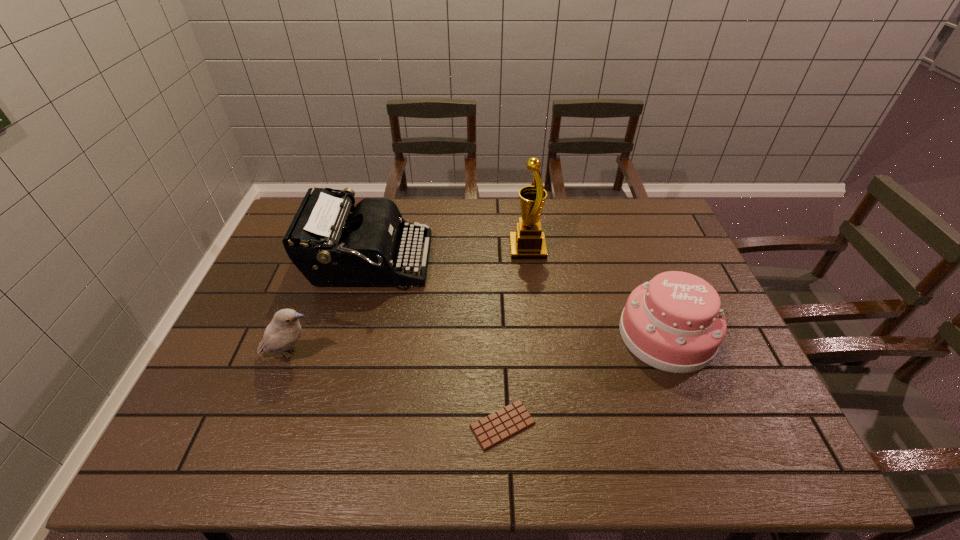
Identify the location of free spot that satisfies the following two spatial constraints: 1. at the beak of the candy bar; 2. on the right side of the bird. (265, 425).